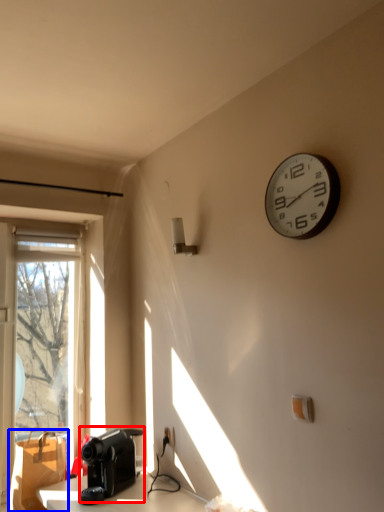
Question: Which object appears farthest to the camera in this image, appliance (highlighted by a red box) or cardboard box (highlighted by a blue box)?

Choices:
 (A) appliance
 (B) cardboard box

Answer: (B)